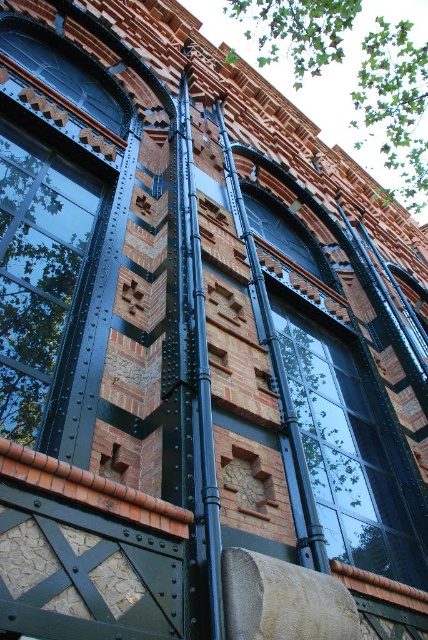
You are an architect examining the building facade. You notice the matte black window at left and the matte black glass window at center. Which window is located higher up on the building?

The matte black window at left is positioned over the matte black glass window at center, meaning it is higher up on the building.

You are a maintenance worker needing to reach both the matte black window at left and the black metal pole at center during your inspection. If your ladder can extend up to 15 meters, will you be able to reach both objects without moving the ladder?

The matte black window at left and the black metal pole at center are 14.27 meters apart from each other. Since the ladder can extend up to 15 meters, which is longer than the distance between them, you can reach both objects without moving the ladder.

You are standing in front of the building and want to take a photo of the black metal pole at center without the matte black glass window at center blocking it. Is this possible?

The black metal pole at center is behind the matte black glass window at center, so it cannot be photographed without the window blocking it.